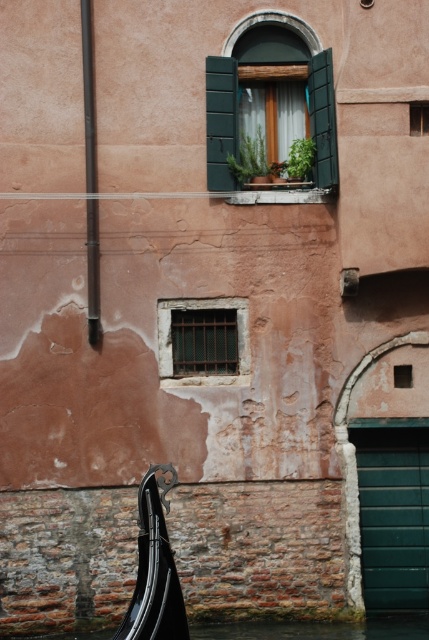
Does point (407, 608) come in front of point (199, 320)?

No.

Who is more distant from viewer, [407,500] or [177,368]?

The point [407,500] is more distant.

Where is `green matte shutter at lower right`? Image resolution: width=429 pixels, height=640 pixels. green matte shutter at lower right is located at coordinates (392, 512).

Is green matte shutter at lower right to the right of smooth dark brown pole at left from the viewer's perspective?

Indeed, green matte shutter at lower right is positioned on the right side of smooth dark brown pole at left.

Can you confirm if green matte shutter at lower right is bigger than smooth dark brown pole at left?

Yes.

Between point (395, 540) and point (93, 202), which one is positioned behind?

The point (395, 540) is behind.

At what (x,y) coordinates should I click in order to perform the action: click on green matte shutter at lower right. Please return your answer as a coordinate pair (x, y). This screenshot has height=640, width=429. Looking at the image, I should click on (392, 512).

Is green matte shutter at lower right further to the viewer compared to matte green window at center?

That is True.

Does green matte shutter at lower right have a larger size compared to matte green window at center?

Indeed, green matte shutter at lower right has a larger size compared to matte green window at center.

Which is behind, point (350, 426) or point (422, 115)?

Point (350, 426)

Identify the location of green matte shutter at lower right. This screenshot has height=640, width=429. (392, 512).